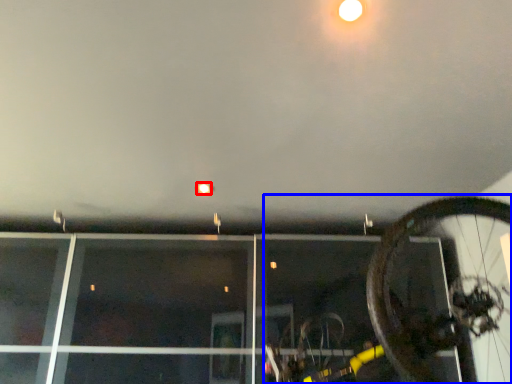
Question: Among these objects, which one is farthest to the camera, droplight (highlighted by a red box) or bicycle (highlighted by a blue box)?

Choices:
 (A) droplight
 (B) bicycle

Answer: (A)